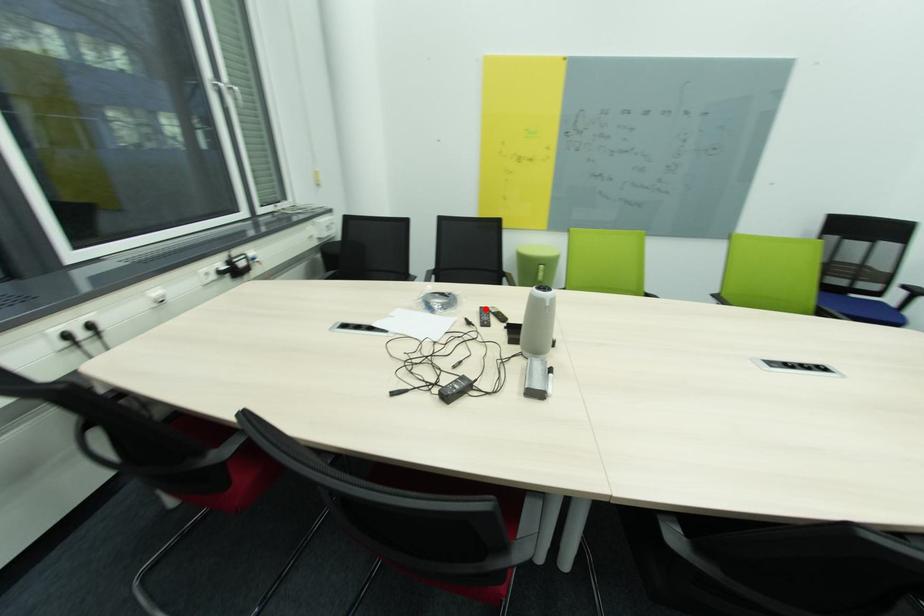
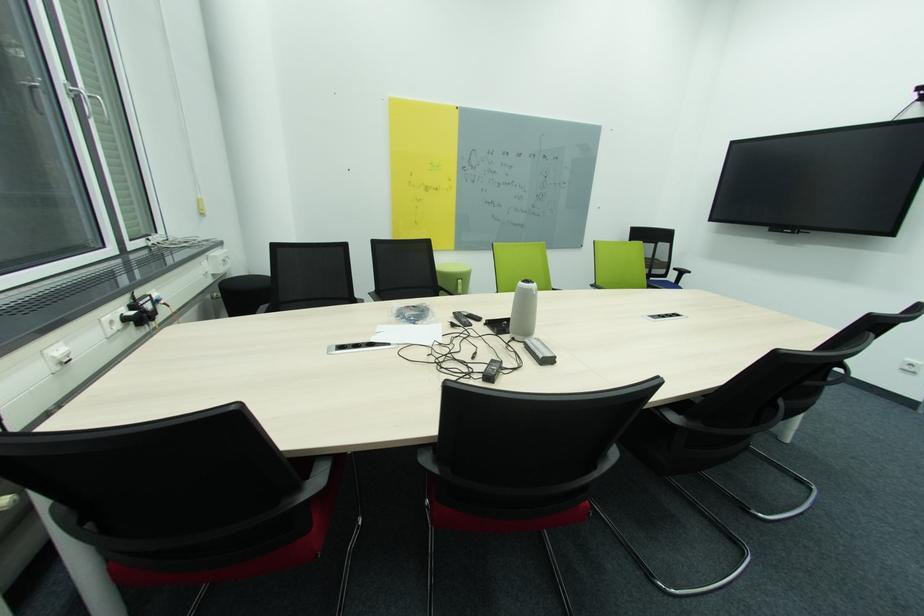
In the second image, find the point that corresponds to the highlighted location in the first image.

(458, 314)